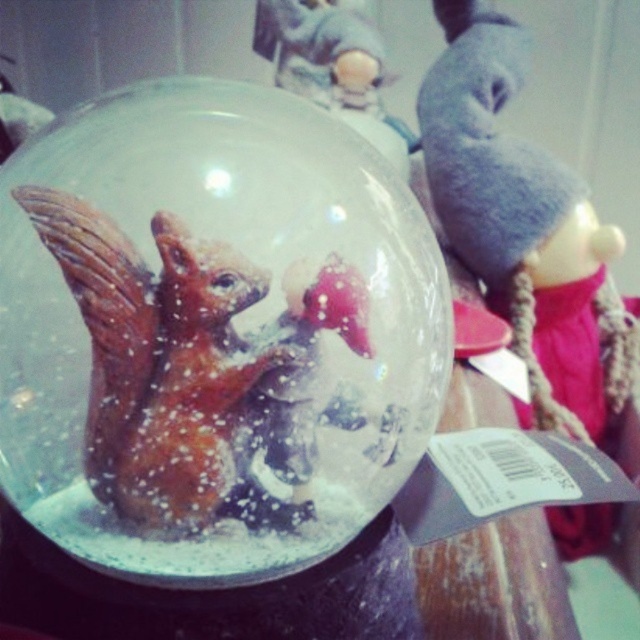
You are holding a snow globe and want to place it on a shelf that is exactly 25 centimeters away from your current position. If the point where you want to place it is at coordinates point (138, 228), will the snow globe fit on the shelf without moving your hand more than 25 centimeters?

The point (138, 228) is 25.78 centimeters away from the camera, which is slightly more than 25 centimeters. Therefore, placing the snow globe there would require moving your hand more than 25 centimeters, so it might not fit without adjusting your position.

You have a box that is exactly the same height as the shiny brown squirrel at center. Can the transparent glass globe at center fit into this box?

The transparent glass globe at center is taller than the shiny brown squirrel at center, so it cannot fit into the box which is only as tall as the squirrel.

You are holding a ruler and want to place a sticker exactly at the center of the transparent glass globe at center. According to the coordinates provided, where should you place the sticker?

The sticker should be placed at the 2D location coordinates of point (212, 332) on the transparent glass globe at center.